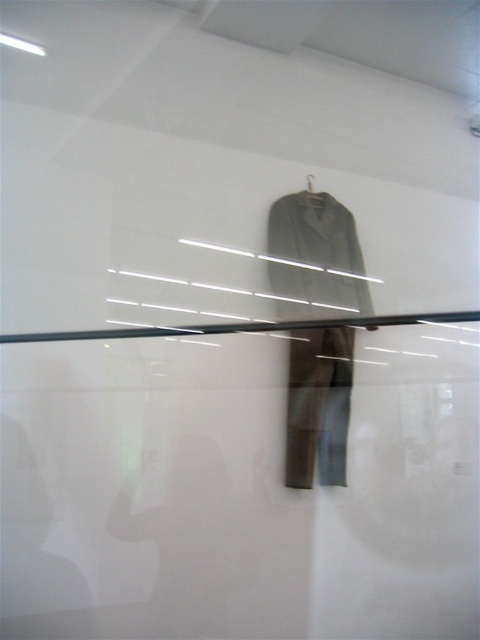
Which is below, dark gray fabric suit at center or gray fabric jacket at center?

dark gray fabric suit at center is below.

This screenshot has width=480, height=640. What do you see at coordinates (314, 259) in the screenshot?
I see `dark gray fabric suit at center` at bounding box center [314, 259].

The image size is (480, 640). In order to click on dark gray fabric suit at center in this screenshot , I will do point(314,259).

Locate an element on the screen. The height and width of the screenshot is (640, 480). dark gray fabric suit at center is located at coordinates (314, 259).

Which is behind, point (70, 499) or point (284, 252)?

The point (284, 252) is behind.

Is transparent glass door at center below gray fabric jacket at center?

Yes, transparent glass door at center is below gray fabric jacket at center.

Does point (236, 396) come closer to viewer compared to point (359, 282)?

Yes, it is.

At what (x,y) coordinates should I click in order to perform the action: click on transparent glass door at center. Please return your answer as a coordinate pair (x, y). Looking at the image, I should click on (236, 492).

Between dark gray fabric suit at center and metallic silver hanger at upper center, which one has less height?

With less height is metallic silver hanger at upper center.

Between dark gray fabric suit at center and metallic silver hanger at upper center, which one appears on the right side from the viewer's perspective?

Positioned to the right is dark gray fabric suit at center.

Is point (292, 216) farther from camera compared to point (314, 198)?

No, (292, 216) is closer to viewer.

Locate an element on the screen. The height and width of the screenshot is (640, 480). dark gray fabric suit at center is located at coordinates (314, 259).